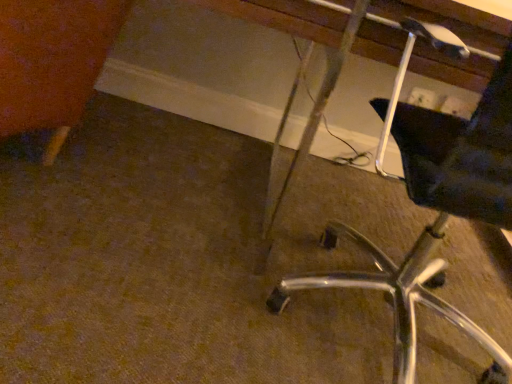
Describe the element at coordinates (436, 210) in the screenshot. I see `black fabric chair at right` at that location.

In order to face black fabric chair at right, should I rotate leftwards or rightwards?

Rotate right and turn 25.471 degrees.

Identify the location of black fabric chair at right. Image resolution: width=512 pixels, height=384 pixels. (436, 210).

Locate an element on the screen. The height and width of the screenshot is (384, 512). metallic silver vanity at lower right is located at coordinates (321, 205).

Describe the element at coordinates (321, 205) in the screenshot. The image size is (512, 384). I see `metallic silver vanity at lower right` at that location.

Locate an element on the screen. Image resolution: width=512 pixels, height=384 pixels. black fabric chair at right is located at coordinates (436, 210).

Does black fabric chair at right appear on the right side of metallic silver vanity at lower right?

Yes.

Between black fabric chair at right and metallic silver vanity at lower right, which one is positioned behind?

metallic silver vanity at lower right.

From the picture: Which is closer, (508, 183) or (287, 120)?

Point (508, 183) is closer to the camera than point (287, 120).

From the image's perspective, is black fabric chair at right positioned above or below metallic silver vanity at lower right?

Clearly, from the image's perspective, black fabric chair at right is below metallic silver vanity at lower right.

From a real-world perspective, relative to metallic silver vanity at lower right, is black fabric chair at right vertically above or below?

From a real-world perspective, black fabric chair at right is physically above metallic silver vanity at lower right.

Which object is wider, black fabric chair at right or metallic silver vanity at lower right?

metallic silver vanity at lower right.

Who is taller, black fabric chair at right or metallic silver vanity at lower right?

Standing taller between the two is metallic silver vanity at lower right.

Is black fabric chair at right smaller than metallic silver vanity at lower right?

Indeed, black fabric chair at right has a smaller size compared to metallic silver vanity at lower right.

Is black fabric chair at right inside or outside of metallic silver vanity at lower right?

black fabric chair at right fits inside metallic silver vanity at lower right.

Is black fabric chair at right touching metallic silver vanity at lower right?

No, black fabric chair at right is not next to metallic silver vanity at lower right.

Could you tell me if black fabric chair at right is turned towards metallic silver vanity at lower right?

Yes, black fabric chair at right is aimed at metallic silver vanity at lower right.

How different are the orientations of black fabric chair at right and metallic silver vanity at lower right in degrees?

There is a 179-degree angle between the facing directions of black fabric chair at right and metallic silver vanity at lower right.

The height and width of the screenshot is (384, 512). What are the coordinates of `vanity behind the black fabric chair at right` in the screenshot? It's located at (321, 205).

In the scene shown: Considering the relative positions of metallic silver vanity at lower right and black fabric chair at right in the image provided, is metallic silver vanity at lower right to the right of black fabric chair at right from the viewer's perspective?

Incorrect, metallic silver vanity at lower right is not on the right side of black fabric chair at right.

Is metallic silver vanity at lower right behind black fabric chair at right?

Yes, metallic silver vanity at lower right is further from the camera.

Is point (234, 13) in front of point (412, 326)?

That is True.

From the image's perspective, which one is positioned lower, metallic silver vanity at lower right or black fabric chair at right?

black fabric chair at right.

From a real-world perspective, which is physically above, metallic silver vanity at lower right or black fabric chair at right?

In real-world perspective, black fabric chair at right is above.

Is metallic silver vanity at lower right thinner than black fabric chair at right?

No.

Considering the sizes of objects metallic silver vanity at lower right and black fabric chair at right in the image provided, who is taller, metallic silver vanity at lower right or black fabric chair at right?

metallic silver vanity at lower right is taller.

Considering the sizes of objects metallic silver vanity at lower right and black fabric chair at right in the image provided, who is bigger, metallic silver vanity at lower right or black fabric chair at right?

Bigger between the two is metallic silver vanity at lower right.

Is black fabric chair at right surrounded by metallic silver vanity at lower right?

Indeed, black fabric chair at right is located within metallic silver vanity at lower right.

Can you see metallic silver vanity at lower right touching black fabric chair at right?

No, metallic silver vanity at lower right is not in contact with black fabric chair at right.

Is metallic silver vanity at lower right facing towards black fabric chair at right?

Yes, metallic silver vanity at lower right is facing black fabric chair at right.

Where is `chair located in front of the metallic silver vanity at lower right`? This screenshot has width=512, height=384. chair located in front of the metallic silver vanity at lower right is located at coordinates (436, 210).

This screenshot has width=512, height=384. Find the location of `vanity on the left of black fabric chair at right`. vanity on the left of black fabric chair at right is located at coordinates (321, 205).

At what (x,y) coordinates should I click in order to perform the action: click on chair that appears on the right of metallic silver vanity at lower right. Please return your answer as a coordinate pair (x, y). Image resolution: width=512 pixels, height=384 pixels. Looking at the image, I should click on (436, 210).